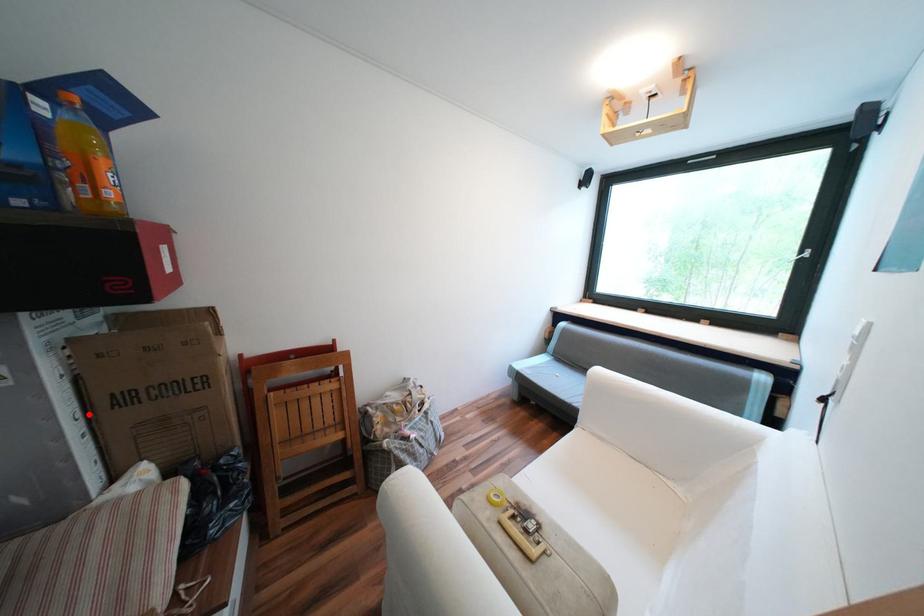
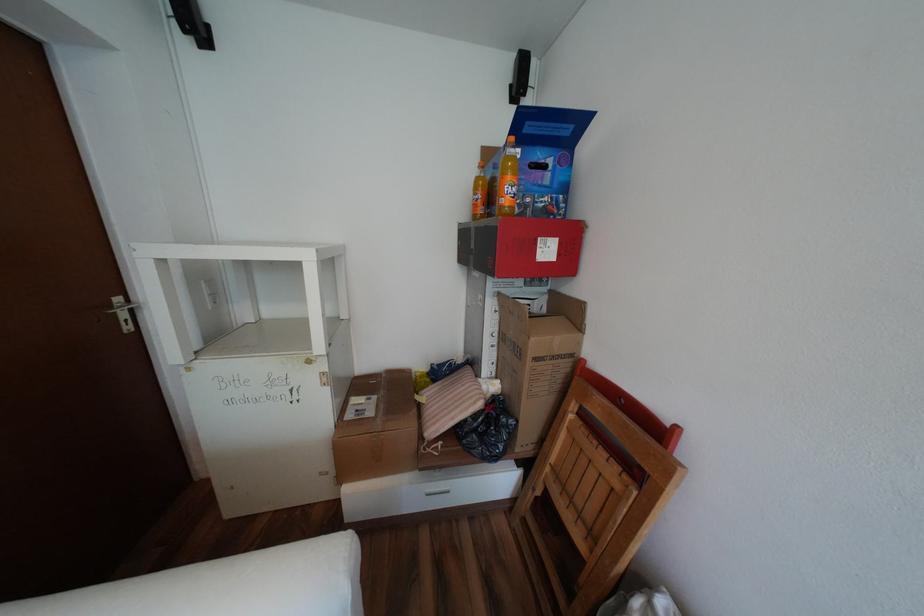
The point at the highlighted location is marked in the first image. Where is the corresponding point in the second image?

(505, 334)